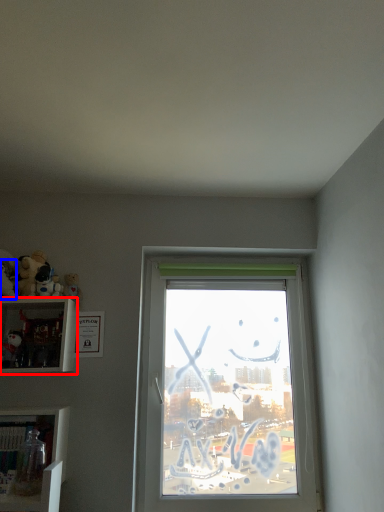
Question: Which object is further to the camera taking this photo, shelf (highlighted by a red box) or toy (highlighted by a blue box)?

Choices:
 (A) shelf
 (B) toy

Answer: (B)